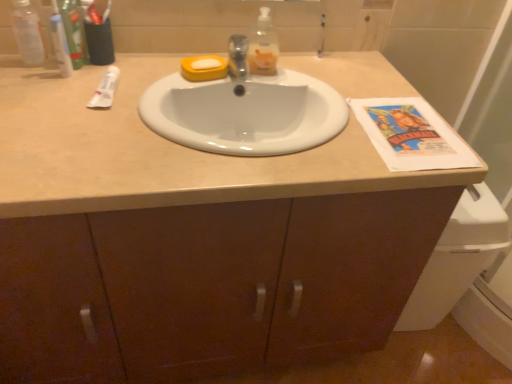
Question: Is white glossy sink at center taller or shorter than translucent plastic soap dispenser at upper center, the second bottle in the left-to-right sequence?

Choices:
 (A) short
 (B) tall

Answer: (A)

Question: Considering the relative positions of white glossy sink at center and translucent plastic soap dispenser at upper center, the second bottle in the left-to-right sequence, in the image provided, is white glossy sink at center to the left or to the right of translucent plastic soap dispenser at upper center, the second bottle in the left-to-right sequence,?

Choices:
 (A) left
 (B) right

Answer: (A)

Question: Estimate the real-world distances between objects in this image. Which object is closer to the white glossy sink at center?

Choices:
 (A) translucent plastic toothbrush holder at upper left, which appears as the 1th toiletry when viewed from the right
 (B) transparent plastic bottle at upper left, acting as the 2th bottle starting from the right
 (C) white matte tube at upper left
 (D) green plastic toothpaste tube at upper left, which ranks as the first toiletry in left-to-right order
 (E) translucent plastic soap dispenser at upper center, placed as the first bottle when sorted from right to left

Answer: (E)

Question: Which of these objects is positioned farthest from the green plastic toothpaste tube at upper left, which ranks as the first toiletry in left-to-right order?

Choices:
 (A) transparent plastic bottle at upper left, the first bottle in the left-to-right sequence
 (B) translucent plastic soap dispenser at upper center, placed as the first bottle when sorted from right to left
 (C) translucent plastic toothbrush holder at upper left, which appears as the 1th toiletry when viewed from the right
 (D) white glossy sink at center
 (E) white matte tube at upper left

Answer: (B)